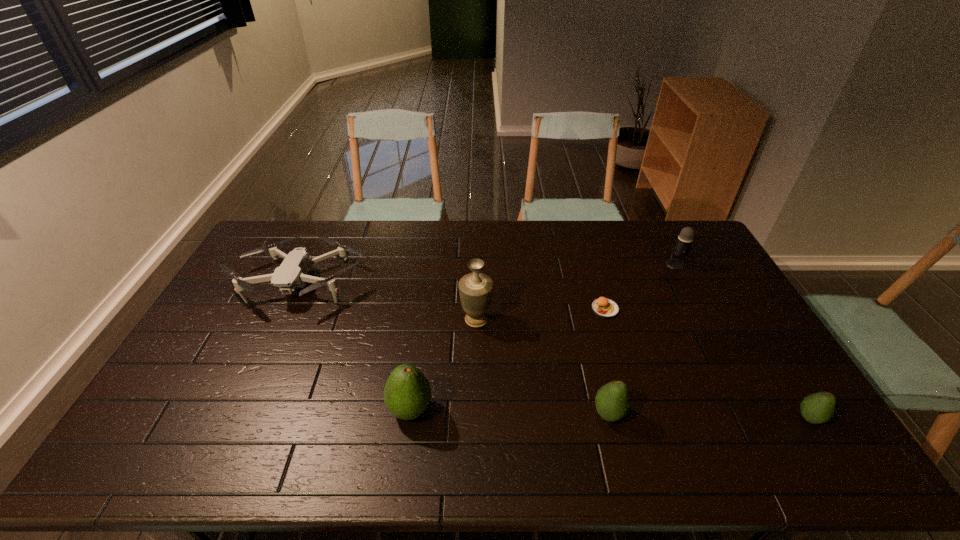
Identify which avocado is the third nearest to the drone. Please provide its 2D coordinates. Your answer should be formatted as a tuple, i.e. [(x, y)], where the tuple contains the x and y coordinates of a point satisfying the conditions above.

[(817, 408)]

Where is `vacant space that satisfies the following two spatial constraints: 1. on the back side of the second object from right to left; 2. on the left side of the tallest object`? The height and width of the screenshot is (540, 960). vacant space that satisfies the following two spatial constraints: 1. on the back side of the second object from right to left; 2. on the left side of the tallest object is located at coordinates 477,265.